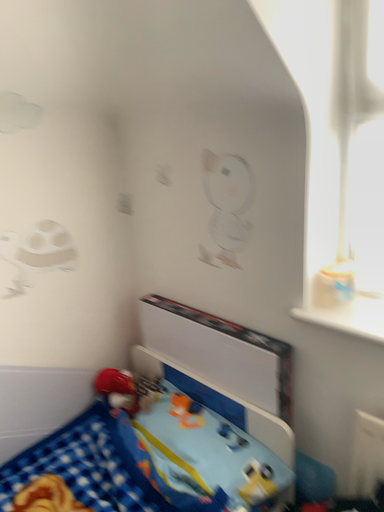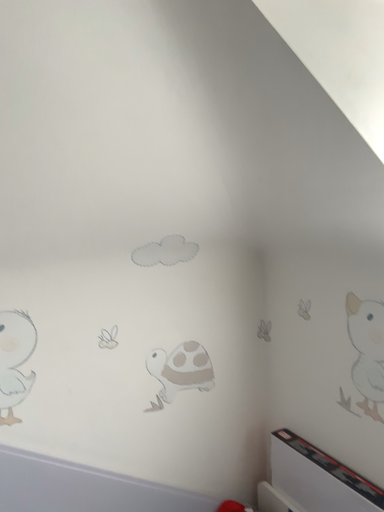
Question: How did the camera likely rotate when shooting the video?

Choices:
 (A) rotated left
 (B) rotated right

Answer: (A)